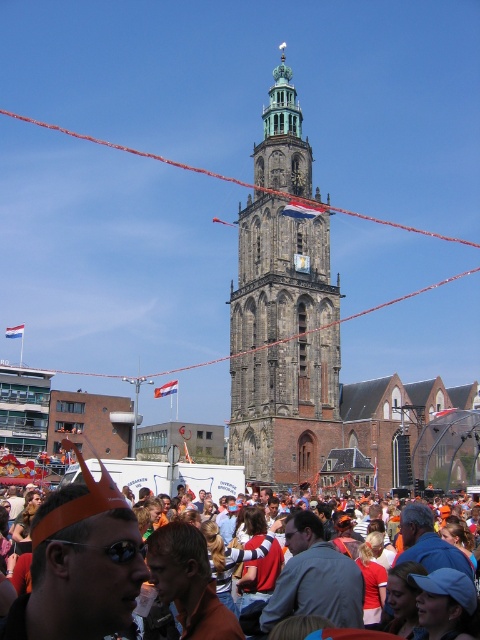
Question: Is orange fabric crowd at lower center thinner than stone tower at center?

Choices:
 (A) yes
 (B) no

Answer: (A)

Question: Among these points, which one is farthest from the camera?

Choices:
 (A) (20, 118)
 (B) (295, 212)
 (C) (103, 573)

Answer: (A)

Question: Which object appears closest to the camera in this image?

Choices:
 (A) stone tower at center
 (B) orange fabric crowd at lower center
 (C) stone brick bell tower at center

Answer: (B)

Question: Which point is closer to the camera?

Choices:
 (A) (271, 179)
 (B) (264, 188)
 (C) (132, 589)

Answer: (C)

Question: Is stone brick bell tower at center further to camera compared to stone tower at center?

Choices:
 (A) yes
 (B) no

Answer: (B)

Question: From the image, what is the correct spatial relationship of orange fabric crowd at lower center in relation to stone tower at center?

Choices:
 (A) left
 (B) right

Answer: (B)